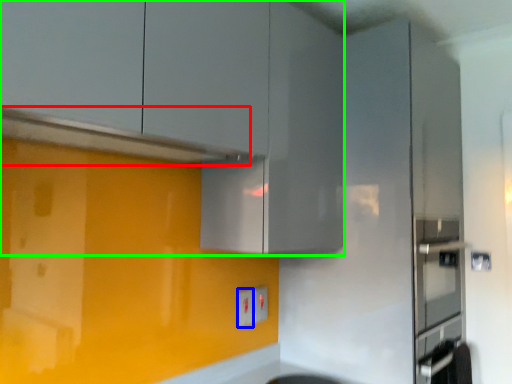
Question: Based on their relative distances, which object is farther from exhaust hood (highlighted by a red box)? Choose from electric outlet (highlighted by a blue box) and cabinetry (highlighted by a green box).

Choices:
 (A) electric outlet
 (B) cabinetry

Answer: (A)